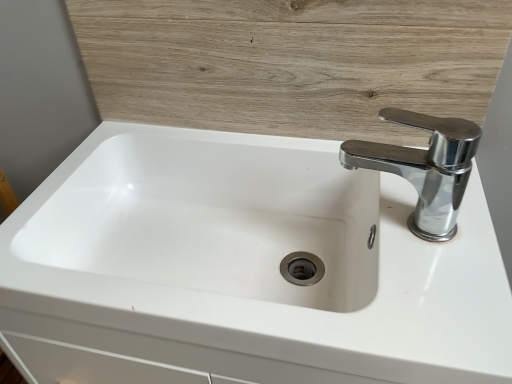
Question: From the image's perspective, is chrome metallic faucet at upper right under white glossy sink at center?

Choices:
 (A) no
 (B) yes

Answer: (A)

Question: Is chrome metallic faucet at upper right shorter than white glossy sink at center?

Choices:
 (A) yes
 (B) no

Answer: (A)

Question: Is chrome metallic faucet at upper right placed right next to white glossy sink at center?

Choices:
 (A) yes
 (B) no

Answer: (B)

Question: Would you say chrome metallic faucet at upper right is outside white glossy sink at center?

Choices:
 (A) no
 (B) yes

Answer: (B)

Question: Is chrome metallic faucet at upper right positioned with its back to white glossy sink at center?

Choices:
 (A) no
 (B) yes

Answer: (A)

Question: From a real-world perspective, is chrome metallic faucet at upper right over white glossy sink at center?

Choices:
 (A) yes
 (B) no

Answer: (A)

Question: Can you confirm if white glossy sink at center is smaller than wooden panel at upper center?

Choices:
 (A) no
 (B) yes

Answer: (A)

Question: Is white glossy sink at center aimed at wooden panel at upper center?

Choices:
 (A) yes
 (B) no

Answer: (B)

Question: Are white glossy sink at center and wooden panel at upper center far apart?

Choices:
 (A) no
 (B) yes

Answer: (A)

Question: Does white glossy sink at center appear on the right side of wooden panel at upper center?

Choices:
 (A) no
 (B) yes

Answer: (A)

Question: Is the position of white glossy sink at center less distant than that of wooden panel at upper center?

Choices:
 (A) yes
 (B) no

Answer: (A)

Question: Can you confirm if white glossy sink at center is wider than wooden panel at upper center?

Choices:
 (A) yes
 (B) no

Answer: (A)

Question: Considering the relative sizes of wooden panel at upper center and white glossy sink at center in the image provided, is wooden panel at upper center shorter than white glossy sink at center?

Choices:
 (A) yes
 (B) no

Answer: (A)